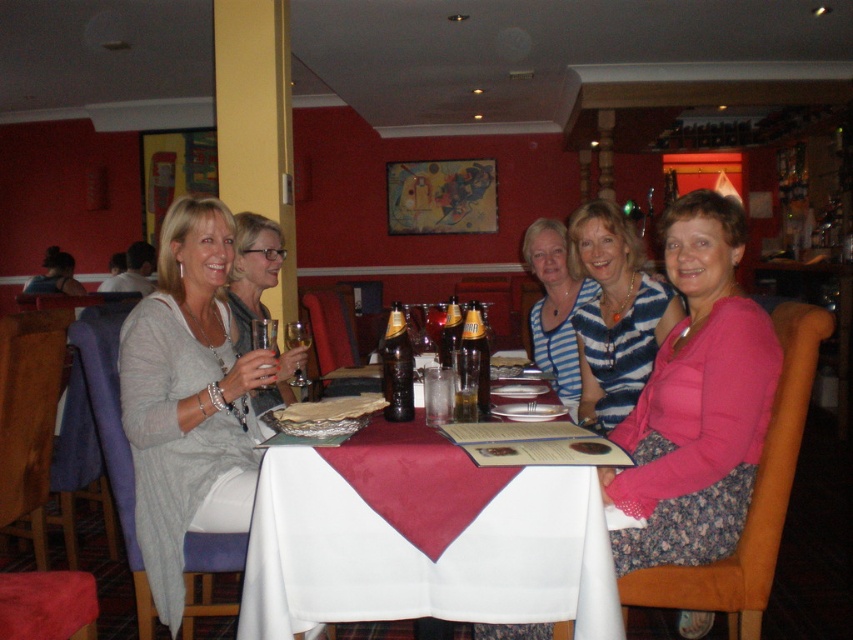
Who is higher up, striped knit top at center or translucent glass beer at table center?

striped knit top at center is higher up.

What do you see at coordinates (614, 314) in the screenshot?
I see `striped knit top at center` at bounding box center [614, 314].

The image size is (853, 640). What do you see at coordinates (614, 314) in the screenshot?
I see `striped knit top at center` at bounding box center [614, 314].

Locate an element on the screen. The height and width of the screenshot is (640, 853). striped knit top at center is located at coordinates (614, 314).

Is silver foil tray at table center closer to the viewer compared to translucent glass beer at table center?

That is True.

I want to click on silver foil tray at table center, so click(331, 408).

Based on the photo, is silver foil tray at table center positioned before smooth brown bread at table center?

No, silver foil tray at table center is further to the viewer.

Can you confirm if silver foil tray at table center is shorter than smooth brown bread at table center?

No.

Who is more forward, (358, 403) or (590, 454)?

Positioned in front is point (590, 454).

This screenshot has width=853, height=640. In order to click on silver foil tray at table center in this screenshot , I will do `click(331, 408)`.